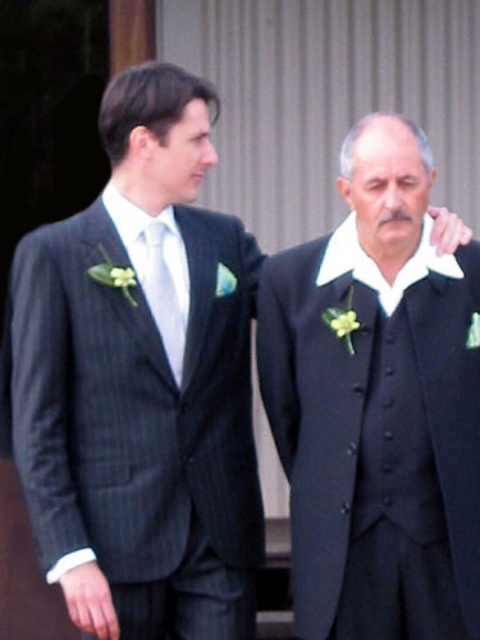
Does black textured suit at center appear on the left side of pinstripe fabric suit at left?

Incorrect, black textured suit at center is not on the left side of pinstripe fabric suit at left.

Is black textured suit at center shorter than pinstripe fabric suit at left?

In fact, black textured suit at center may be taller than pinstripe fabric suit at left.

The image size is (480, 640). Describe the element at coordinates (377, 404) in the screenshot. I see `black textured suit at center` at that location.

At what (x,y) coordinates should I click in order to perform the action: click on black textured suit at center. Please return your answer as a coordinate pair (x, y). Looking at the image, I should click on (377, 404).

Where is `pinstripe fabric suit at left`? pinstripe fabric suit at left is located at coordinates (134, 401).

Which of these two, pinstripe fabric suit at left or matte silver tie at center, stands taller?

Standing taller between the two is pinstripe fabric suit at left.

Between point (197, 422) and point (180, 269), which one is positioned behind?

The point (180, 269) is more distant.

This screenshot has height=640, width=480. In order to click on pinstripe fabric suit at left in this screenshot , I will do `click(134, 401)`.

Is black textured suit at center to the left of matte silver tie at center from the viewer's perspective?

Incorrect, black textured suit at center is not on the left side of matte silver tie at center.

Can you confirm if black textured suit at center is wider than matte silver tie at center?

Yes.

Between point (360, 321) and point (170, 312), which one is positioned behind?

Point (170, 312)

Locate an element on the screen. black textured suit at center is located at coordinates (377, 404).